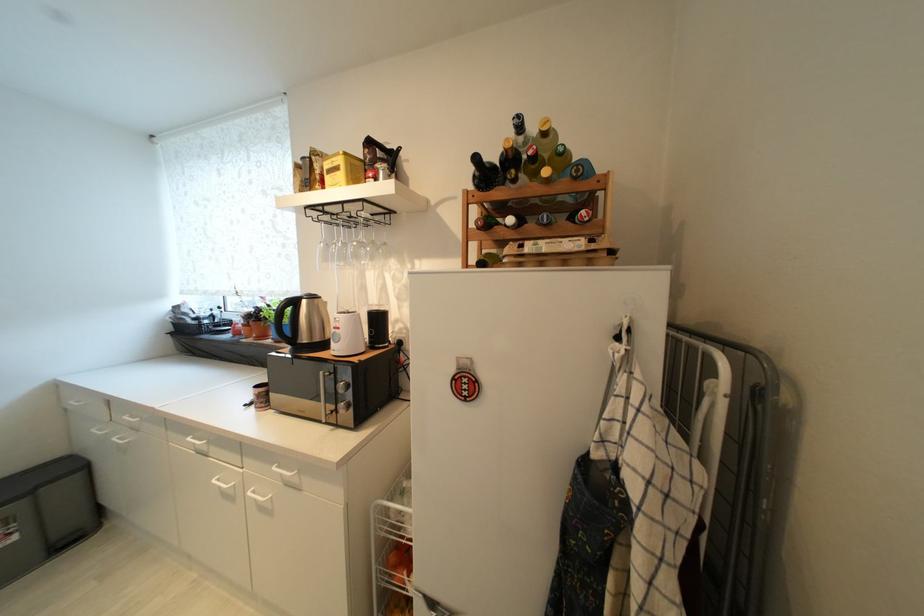
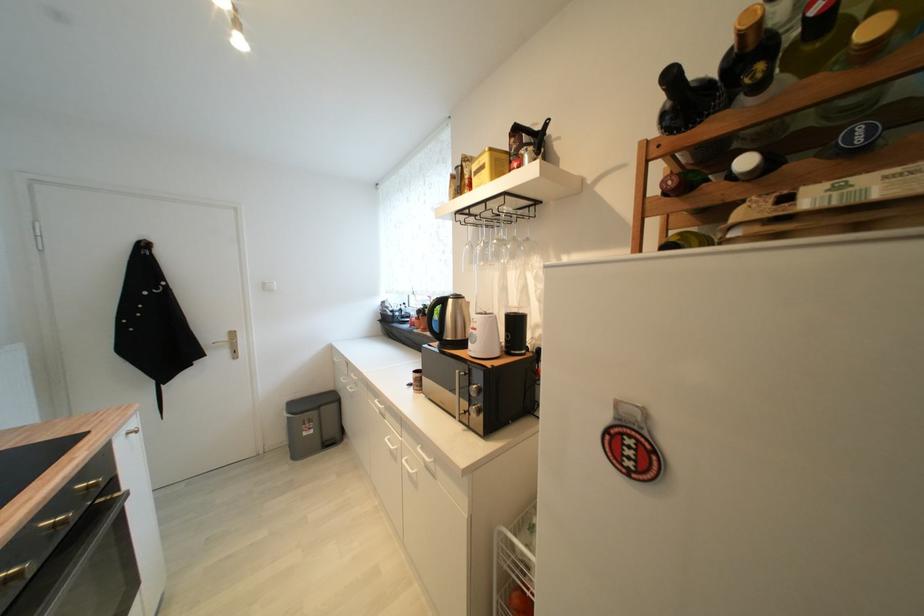
Locate, in the second image, the point that corresponds to [362,244] in the first image.

(504, 241)